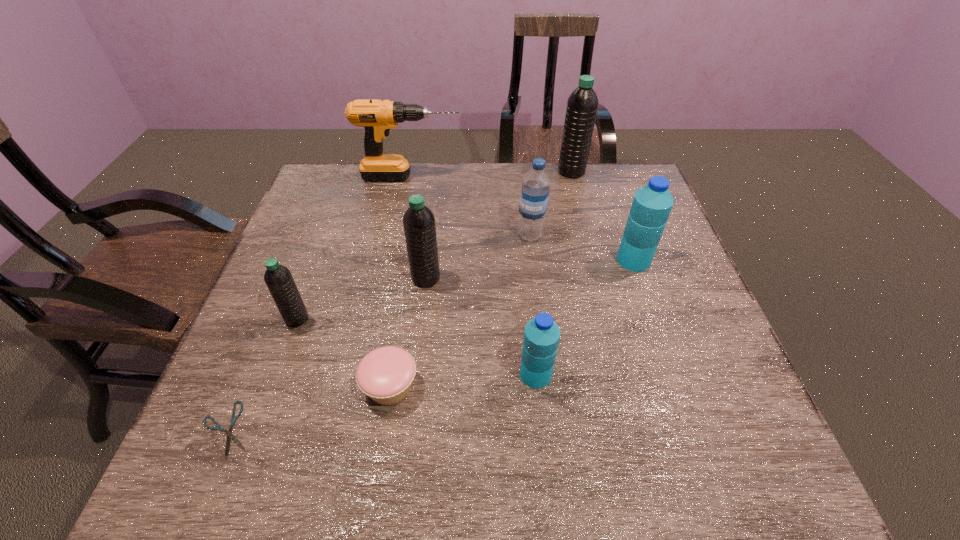
You are a GUI agent. You are given a task and a screenshot of the screen. Output one action in this format:
    pyautogui.click(x=<x>, y=<y>)
    Task: Click on the vacant space situated 0.300m on the back of the rightmost blue water bottle
    
    Given the screenshot: What is the action you would take?
    pyautogui.click(x=607, y=184)

Find the location of a particular element. free space located on the label of the fifth nearest water bottle is located at coordinates pos(447,235).

This screenshot has width=960, height=540. I want to click on vacant space located on the label of the fifth nearest water bottle, so click(433, 235).

Image resolution: width=960 pixels, height=540 pixels. Identify the location of vacant space situated on the label of the fifth nearest water bottle. (421, 235).

Where is `free space located 0.100m on the front of the second nearest water bottle`? free space located 0.100m on the front of the second nearest water bottle is located at coordinates (279, 367).

Identify the location of vacant point located 0.170m on the back of the smallest blue water bottle. (528, 300).

The width and height of the screenshot is (960, 540). Identify the location of vacant space situated 0.080m on the left of the pink cupcake. (322, 386).

The image size is (960, 540). I want to click on free space located 0.380m on the back of the shears, so click(x=295, y=265).

Image resolution: width=960 pixels, height=540 pixels. Find the location of `water bottle located at the far edge`. water bottle located at the far edge is located at coordinates (582, 104).

The height and width of the screenshot is (540, 960). What are the coordinates of `drill that is at the far edge` in the screenshot? It's located at point(377,117).